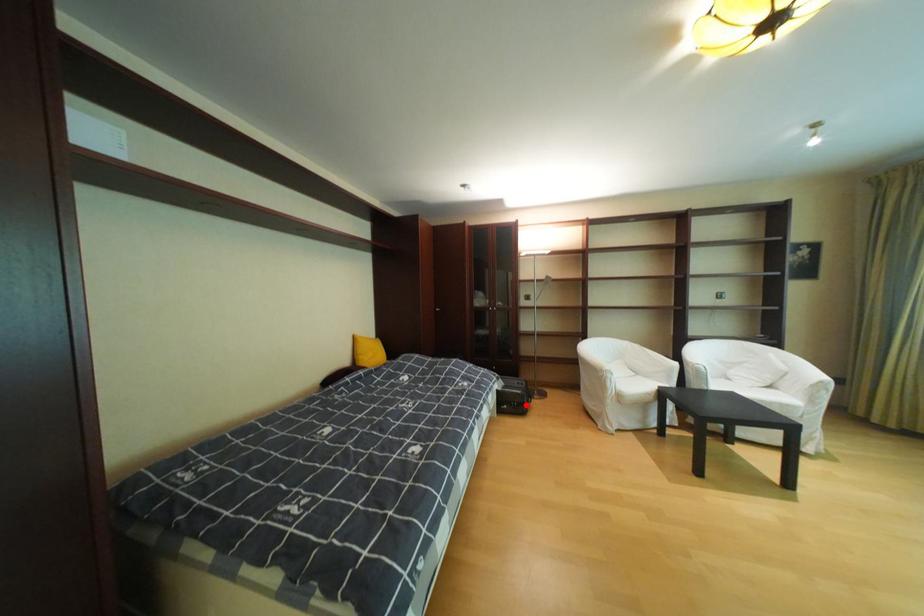
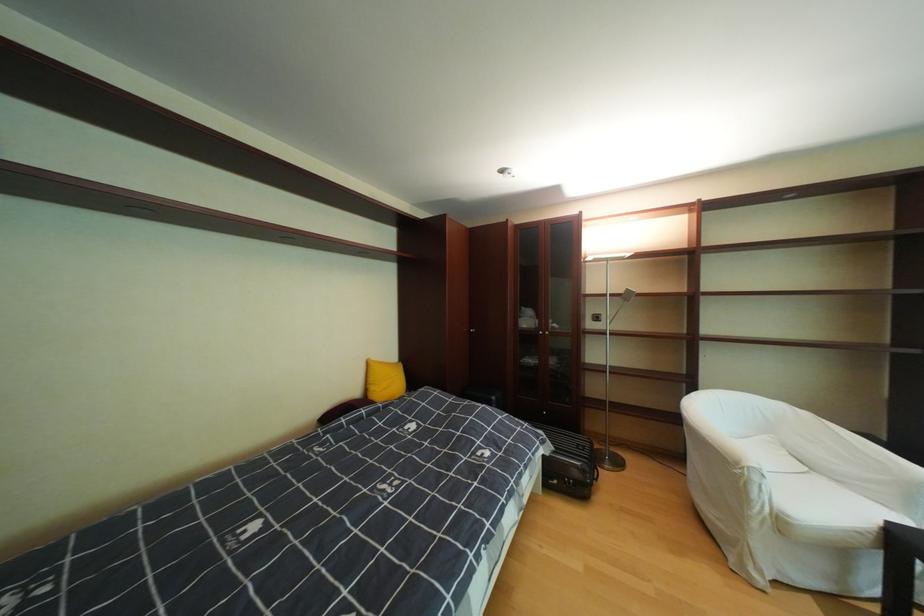
Question: I am providing you with two images of the same scene from different viewpoints. A red point is marked on the first image. Is the red point's position out of view in image 2?

Choices:
 (A) Yes
 (B) No

Answer: (B)